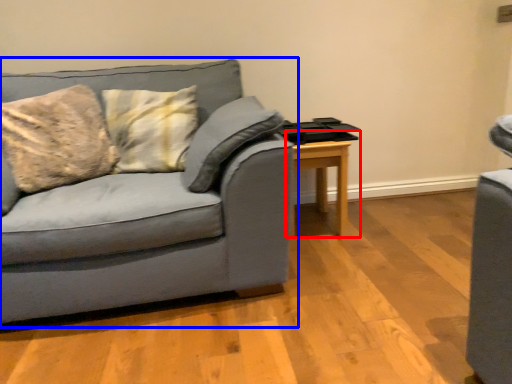
Question: Which object appears farthest to the camera in this image, table (highlighted by a red box) or studio couch (highlighted by a blue box)?

Choices:
 (A) table
 (B) studio couch

Answer: (A)